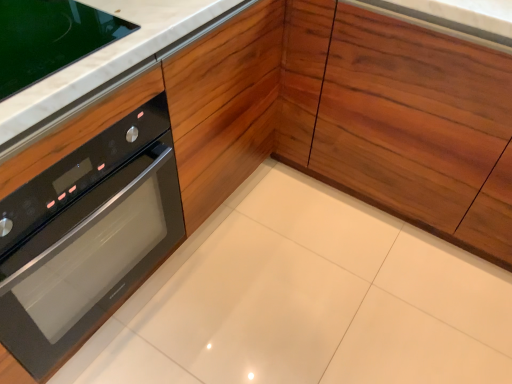
In order to face wooden at center, should I rotate leftwards or rightwards?

Turn right by 23.776 degrees to look at wooden at center.

What do you see at coordinates (85, 54) in the screenshot? The height and width of the screenshot is (384, 512). I see `white marble countertop at upper left` at bounding box center [85, 54].

At what (x,y) coordinates should I click in order to perform the action: click on white marble countertop at upper left. Please return your answer as a coordinate pair (x, y). This screenshot has width=512, height=384. Looking at the image, I should click on (85, 54).

What do you see at coordinates (86, 236) in the screenshot? This screenshot has height=384, width=512. I see `black glass oven at left` at bounding box center [86, 236].

Image resolution: width=512 pixels, height=384 pixels. I want to click on wooden at center, so click(411, 115).

Which of these two, wooden at center or black glass oven at left, stands taller?

Standing taller between the two is wooden at center.

Do you think wooden at center is within black glass oven at left, or outside of it?

wooden at center is not enclosed by black glass oven at left.

From a real-world perspective, is wooden at center above or below black glass oven at left?

wooden at center is above black glass oven at left.

Is wooden at center beside black glass oven at left?

wooden at center and black glass oven at left are clearly separated.

Which is behind, point (168, 18) or point (53, 302)?

Positioned behind is point (53, 302).

Is white marble countertop at upper left facing away from black glass oven at left?

No.

From a real-world perspective, who is located higher, white marble countertop at upper left or black glass oven at left?

white marble countertop at upper left is physically above.

Based on their positions, is wooden at center located to the left or right of white marble countertop at upper left?

wooden at center is positioned on white marble countertop at upper left's right side.

Which of these two, wooden at center or white marble countertop at upper left, is bigger?

Bigger between the two is wooden at center.

Considering their positions, is wooden at center located in front of or behind white marble countertop at upper left?

wooden at center is positioned farther from the viewer than white marble countertop at upper left.

Looking at this image, how much distance is there between wooden at center and white marble countertop at upper left?

A distance of 26.55 inches exists between wooden at center and white marble countertop at upper left.

Considering the points (29, 27) and (389, 205), which point is behind, point (29, 27) or point (389, 205)?

The point (389, 205) is behind.

What's the angular difference between white marble countertop at upper left and wooden at center's facing directions?

The angular difference between white marble countertop at upper left and wooden at center is 90 degrees.

Which of these two, white marble countertop at upper left or wooden at center, is smaller?

With smaller size is white marble countertop at upper left.

In the scene shown: From a real-world perspective, relative to wooden at center, is white marble countertop at upper left vertically above or below?

From a real-world perspective, white marble countertop at upper left is physically above wooden at center.

From the image's perspective, between black glass oven at left and wooden at center, who is located below?

black glass oven at left, from the image's perspective.

Is the position of black glass oven at left more distant than that of wooden at center?

No, it is in front of wooden at center.

Which of these two, black glass oven at left or wooden at center, stands shorter?

black glass oven at left is shorter.

Is black glass oven at left positioned with its back to white marble countertop at upper left?

No, white marble countertop at upper left is not at the back of black glass oven at left.

Find the location of a particular element. The width and height of the screenshot is (512, 384). counter top that appears behind the black glass oven at left is located at coordinates (85, 54).

Does point (95, 156) come in front of point (20, 40)?

No, it is behind (20, 40).

Is black glass oven at left in front of or behind white marble countertop at upper left in the image?

In the image, black glass oven at left appears in front of white marble countertop at upper left.

Identify the location of oven on the left of the wooden at center. click(x=86, y=236).

This screenshot has height=384, width=512. Identify the location of oven below the white marble countertop at upper left (from a real-world perspective). (86, 236).

Looking at the image, which one is located further to white marble countertop at upper left, wooden at center or black glass oven at left?

wooden at center is positioned further to the anchor white marble countertop at upper left.

Based on the photo, when comparing their distances from wooden at center, does white marble countertop at upper left or black glass oven at left seem closer?

white marble countertop at upper left.

Estimate the real-world distances between objects in this image. Which object is closer to black glass oven at left, white marble countertop at upper left or wooden at center?

The object closer to black glass oven at left is white marble countertop at upper left.

Considering their positions, is wooden at center positioned closer to black glass oven at left than white marble countertop at upper left?

white marble countertop at upper left is closer to black glass oven at left.

When comparing their distances from white marble countertop at upper left, does black glass oven at left or wooden at center seem closer?

Among the two, black glass oven at left is located nearer to white marble countertop at upper left.

From the image, which object appears to be farther from wooden at center, black glass oven at left or white marble countertop at upper left?

Based on the image, black glass oven at left appears to be further to wooden at center.

Locate an element on the screen. counter top between black glass oven at left and wooden at center is located at coordinates (85, 54).